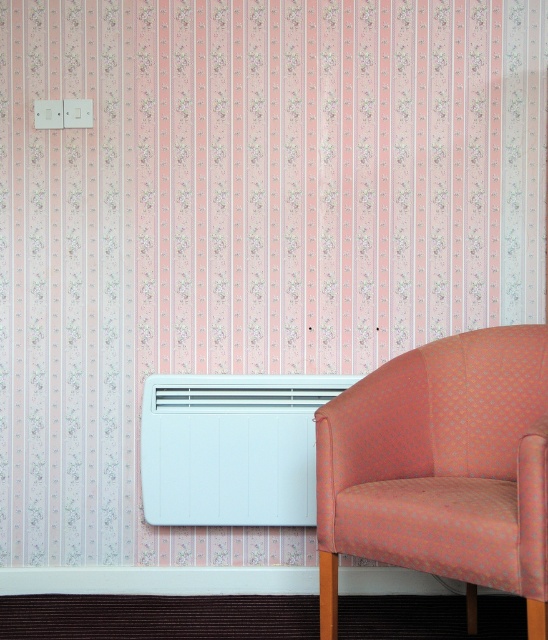
You are standing in the room and want to sit in the orange fabric armchair at lower right. Which direction should you move relative to the white matte air conditioner at lower center?

The orange fabric armchair at lower right is to the right of the white matte air conditioner at lower center, so you should move towards the right side of the white matte air conditioner at lower center to reach the orange fabric armchair at lower right.

You are standing in the room and want to sit down. The orange fabric armchair at lower right is your target. Based on its position coordinates, can you estimate where it is located relative to the heater?

The orange fabric armchair at lower right is positioned to the right of the heater since its coordinates are at point (442, 468), which places it in the lower right area of the room relative to the heater mounted below the switch panel.

You are planning to place a new rectangular side table between the orange fabric armchair at lower right and the white matte air conditioner at lower center. The side table is 1.2 meters wide. Can the table fit between them without overlapping either object?

The orange fabric armchair at lower right is narrower than the white matte air conditioner at lower center. However, the distance between them isn generated in the provided information. Without knowing the exact spacing between the two objects, it is impossible to determine if the 1.2 meter wide side table will fit.